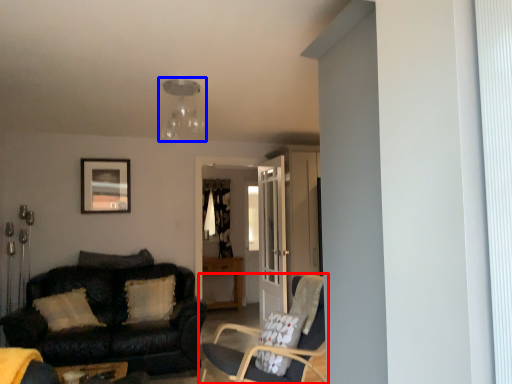
Question: Among these objects, which one is farthest to the camera, chair (highlighted by a red box) or light fixture (highlighted by a blue box)?

Choices:
 (A) chair
 (B) light fixture

Answer: (B)